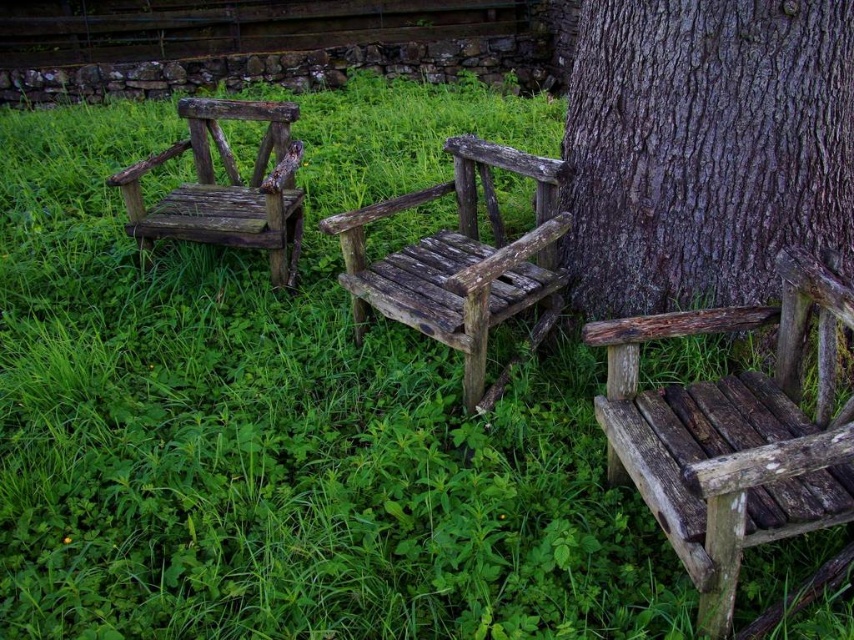
You are sitting on the weathered wood chair at left and want to reach the dark brown textured bark at right to touch it. Which direction should you move to get closer to the bark?

You should move to the right since the dark brown textured bark at right is positioned on the right side of the weathered wood chair at left.